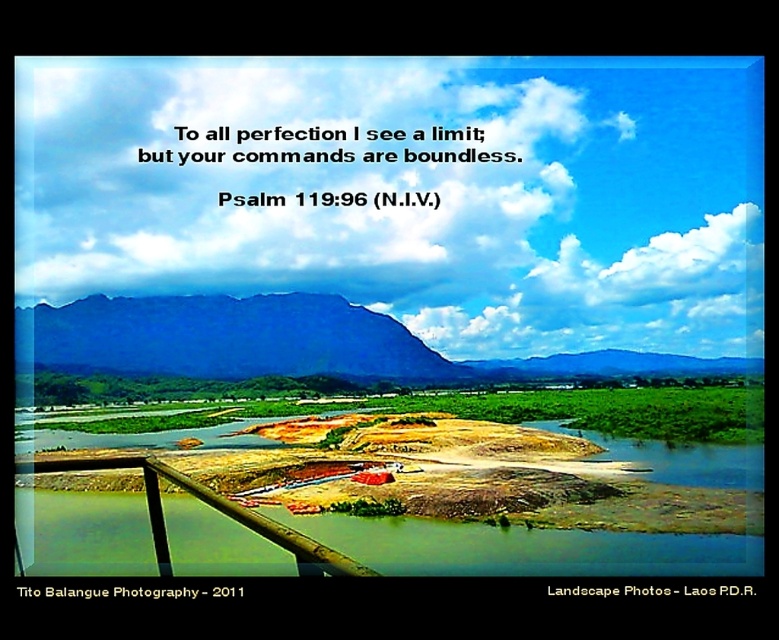
Question: Is the position of brown dirt at lower center more distant than that of brown wooden rail at lower left?

Choices:
 (A) no
 (B) yes

Answer: (B)

Question: Does brown dirt at lower center appear on the right side of brown wooden rail at lower left?

Choices:
 (A) yes
 (B) no

Answer: (A)

Question: Which is farther from the white fluffy cloud at upper center?

Choices:
 (A) brown dirt at lower center
 (B) blue rock mountain at center
 (C) brown wooden rail at lower left

Answer: (C)

Question: Which point is closer to the camera?

Choices:
 (A) brown wooden rail at lower left
 (B) brown dirt at lower center
 (C) blue rock mountain at center

Answer: (A)

Question: Which object appears closest to the camera in this image?

Choices:
 (A) blue rock mountain at center
 (B) brown wooden rail at lower left
 (C) brown dirt at lower center
 (D) white fluffy cloud at upper center

Answer: (B)

Question: Can you confirm if blue rock mountain at center is positioned above brown wooden rail at lower left?

Choices:
 (A) no
 (B) yes

Answer: (B)